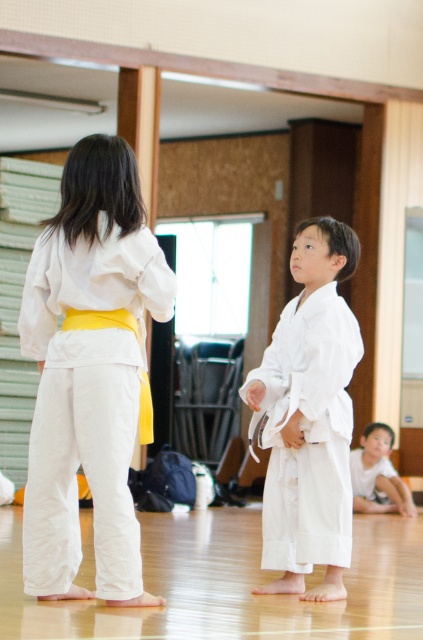
Question: Does white cotton kimono at center appear under smooth white karate gi at lower right?

Choices:
 (A) no
 (B) yes

Answer: (A)

Question: Observing the image, what is the correct spatial positioning of white cotton karate gi at center in reference to white cotton kimono at center?

Choices:
 (A) right
 (B) left

Answer: (B)

Question: Among these objects, which one is farthest from the camera?

Choices:
 (A) smooth white karate gi at lower right
 (B) white cotton karate gi at center
 (C) white cotton kimono at center

Answer: (A)

Question: Which point is closer to the camera taking this photo?

Choices:
 (A) (356, 461)
 (B) (296, 506)
 (C) (62, 241)

Answer: (C)

Question: Can you confirm if white cotton kimono at center is bigger than smooth white karate gi at lower right?

Choices:
 (A) yes
 (B) no

Answer: (A)

Question: Which object is positioned closest to the smooth white karate gi at lower right?

Choices:
 (A) white cotton kimono at center
 (B) white cotton karate gi at center

Answer: (A)